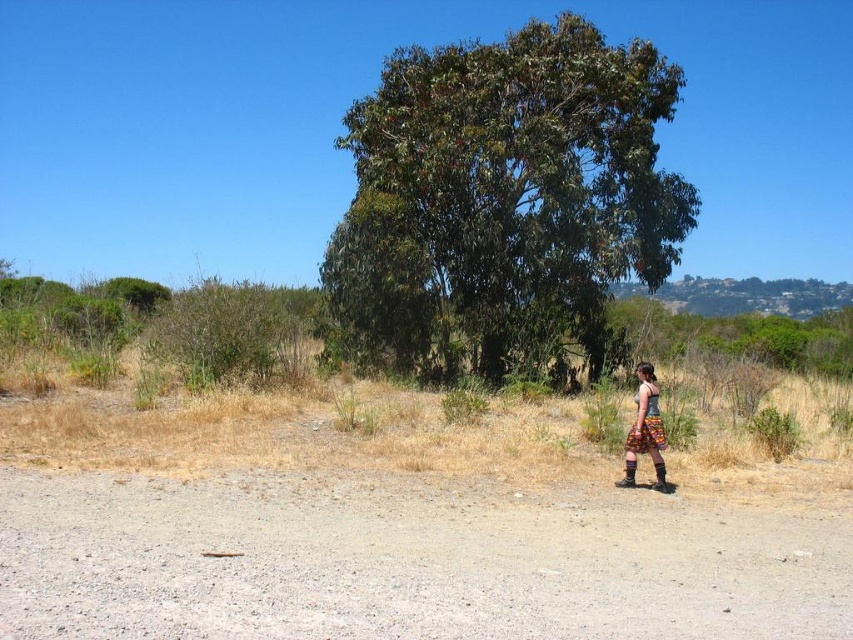
Does gray gravel dirt track at lower center have a larger size compared to printed fabric skirt at lower right?

No, gray gravel dirt track at lower center is not bigger than printed fabric skirt at lower right.

Can you confirm if gray gravel dirt track at lower center is shorter than printed fabric skirt at lower right?

Correct, gray gravel dirt track at lower center is not as tall as printed fabric skirt at lower right.

Is point (474, 612) less distant than point (641, 394)?

Yes.

Locate an element on the screen. The image size is (853, 640). gray gravel dirt track at lower center is located at coordinates (404, 566).

Is gray gravel dirt track at lower center wider than green leafy tree at center?

No.

The image size is (853, 640). What do you see at coordinates (404, 566) in the screenshot? I see `gray gravel dirt track at lower center` at bounding box center [404, 566].

The image size is (853, 640). I want to click on gray gravel dirt track at lower center, so pyautogui.click(x=404, y=566).

Where is `green leafy tree at center`? The width and height of the screenshot is (853, 640). green leafy tree at center is located at coordinates (505, 192).

Who is more forward, (583,257) or (636,451)?

Point (636,451)

Locate an element on the screen. Image resolution: width=853 pixels, height=640 pixels. green leafy tree at center is located at coordinates (505, 192).